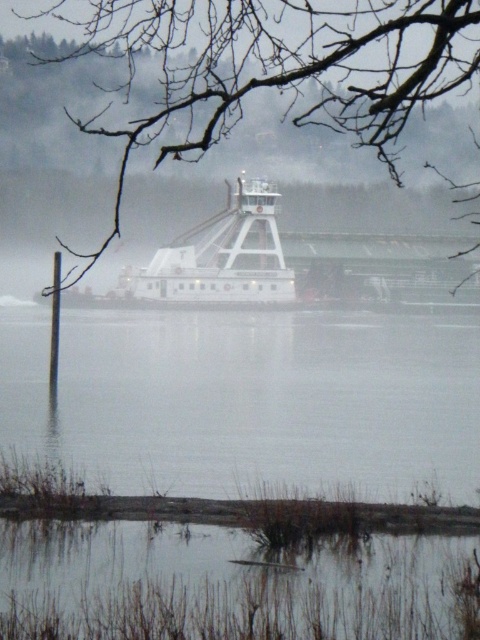
Question: Can you confirm if clear water at lower center is wider than bare branches at upper center?

Choices:
 (A) yes
 (B) no

Answer: (B)

Question: Which point is farther to the camera?

Choices:
 (A) clear water at lower center
 (B) bare branches at upper center

Answer: (A)

Question: Does clear water at lower center appear over bare branches at upper center?

Choices:
 (A) yes
 (B) no

Answer: (B)

Question: Is clear water at lower center to the left of bare branches at upper center from the viewer's perspective?

Choices:
 (A) no
 (B) yes

Answer: (B)

Question: Which object appears farthest from the camera in this image?

Choices:
 (A) bare branches at upper center
 (B) clear water at lower center

Answer: (B)